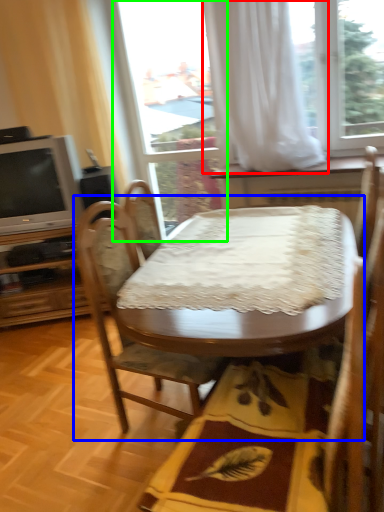
Question: Based on their relative distances, which object is farther from curtain (highlighted by a red box)? Choose from kitchen & dining room table (highlighted by a blue box) and glass door (highlighted by a green box).

Choices:
 (A) kitchen & dining room table
 (B) glass door

Answer: (A)